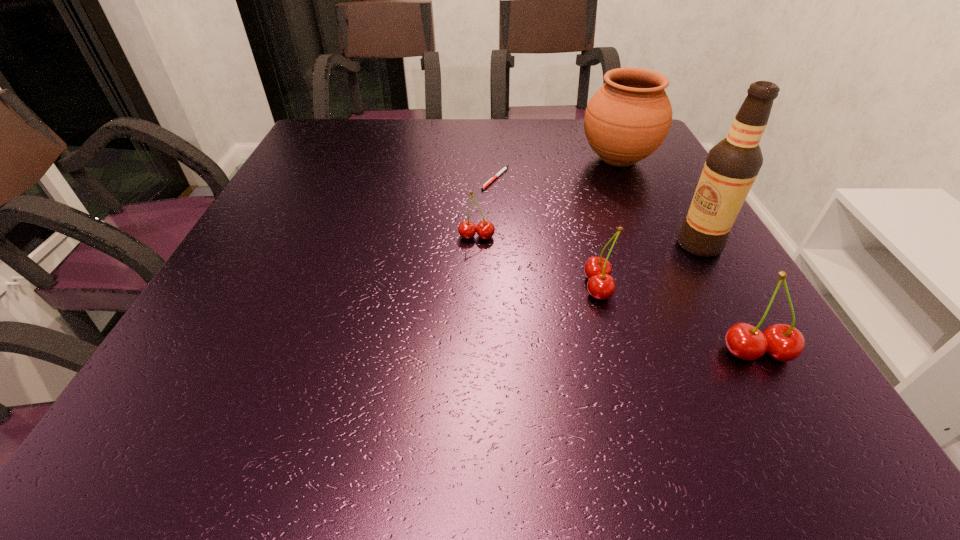
Please point a free position for a cherry on the left. Please provide its 2D coordinates. Your answer should be formatted as a tuple, i.e. [(x, y)], where the tuple contains the x and y coordinates of a point satisfying the conditions above.

[(381, 197)]